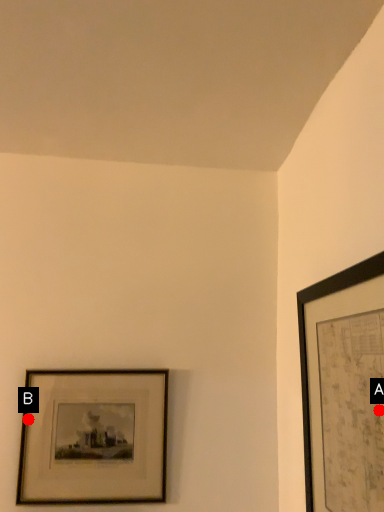
Question: Two points are circled on the image, labeled by A and B beside each circle. Which point is closer to the camera taking this photo?

Choices:
 (A) A is closer
 (B) B is closer

Answer: (A)